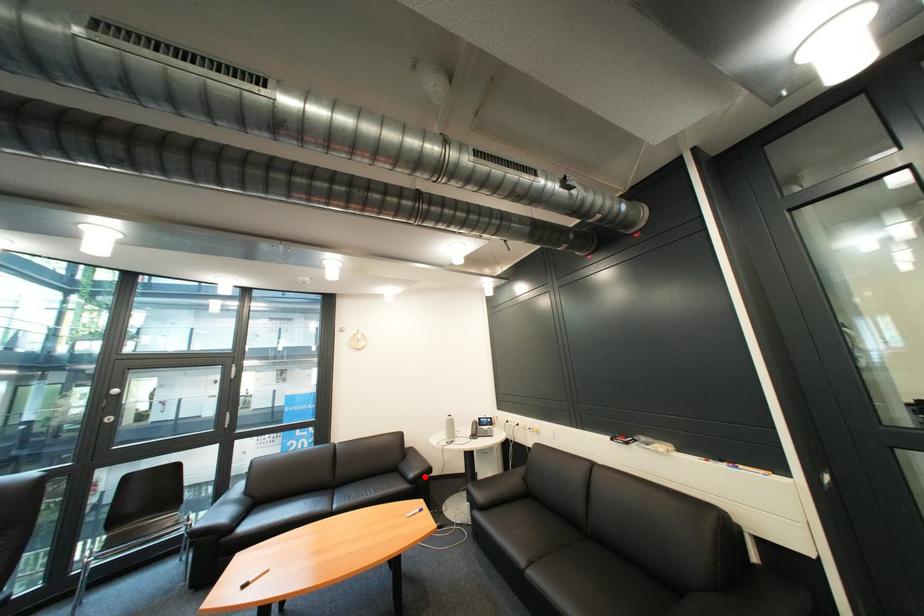
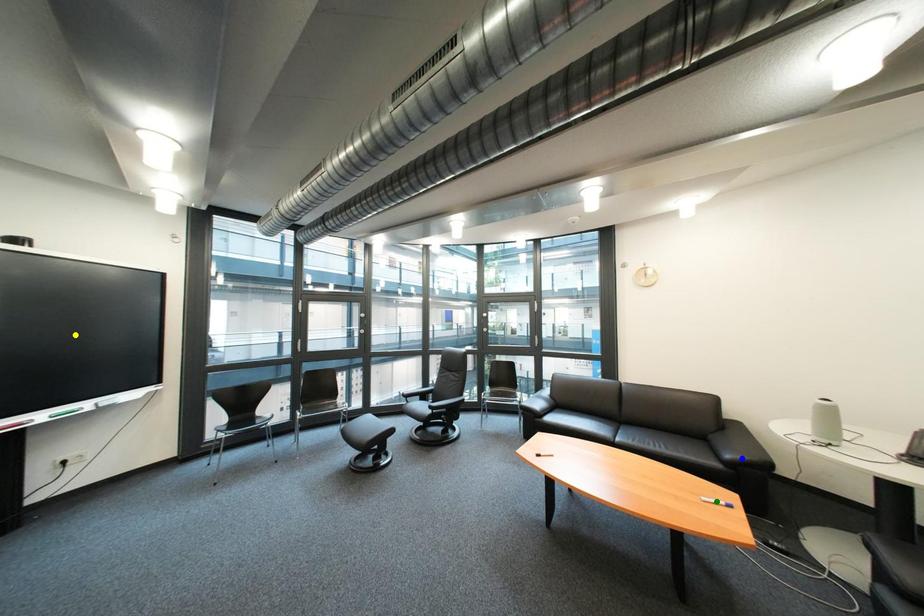
Question: I am providing you with two images of the same scene from different viewpoints. A red point is marked on the first image. You are given multiple points on the second image. Which point in image 2 is actually the same real-world point as the red point in image 1?

Choices:
 (A) yellow point
 (B) blue point
 (C) green point

Answer: (B)